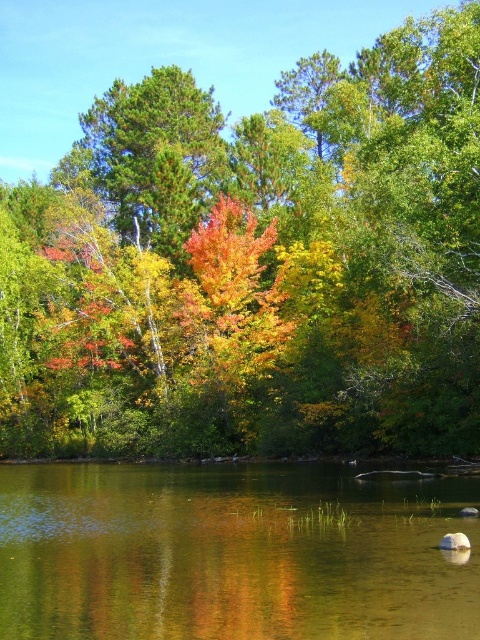
Locate an element on the screen. This screenshot has width=480, height=640. autumn leaves at center is located at coordinates (255, 264).

Based on the photo, can you confirm if autumn leaves at center is positioned above clear water at center?

Correct, autumn leaves at center is located above clear water at center.

Which is behind, point (280, 401) or point (251, 618)?

Point (280, 401)

The image size is (480, 640). I want to click on autumn leaves at center, so click(x=255, y=264).